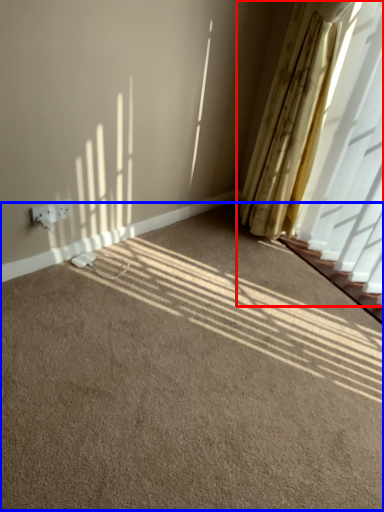
Question: Which point is further to the camera, curtain (highlighted by a red box) or plain (highlighted by a blue box)?

Choices:
 (A) curtain
 (B) plain

Answer: (A)